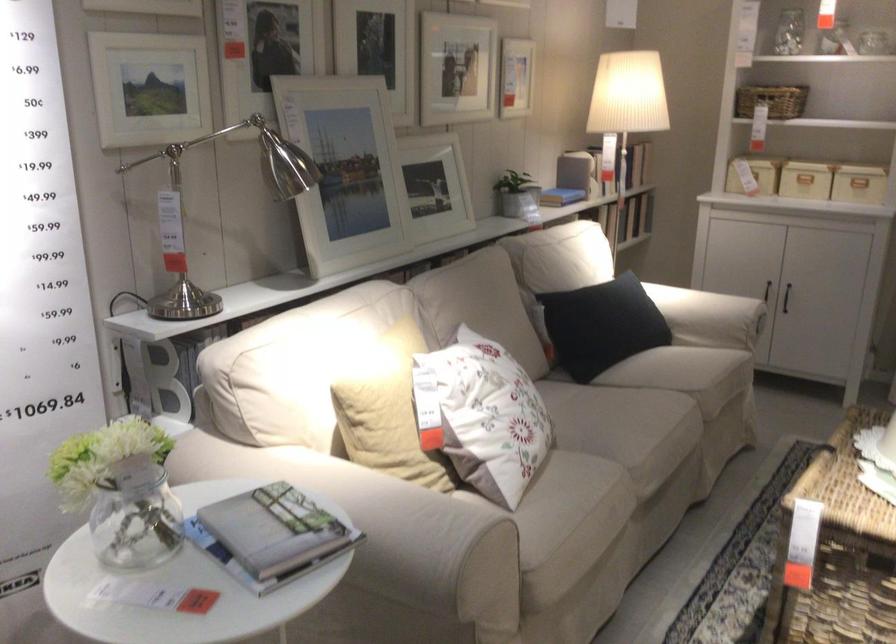
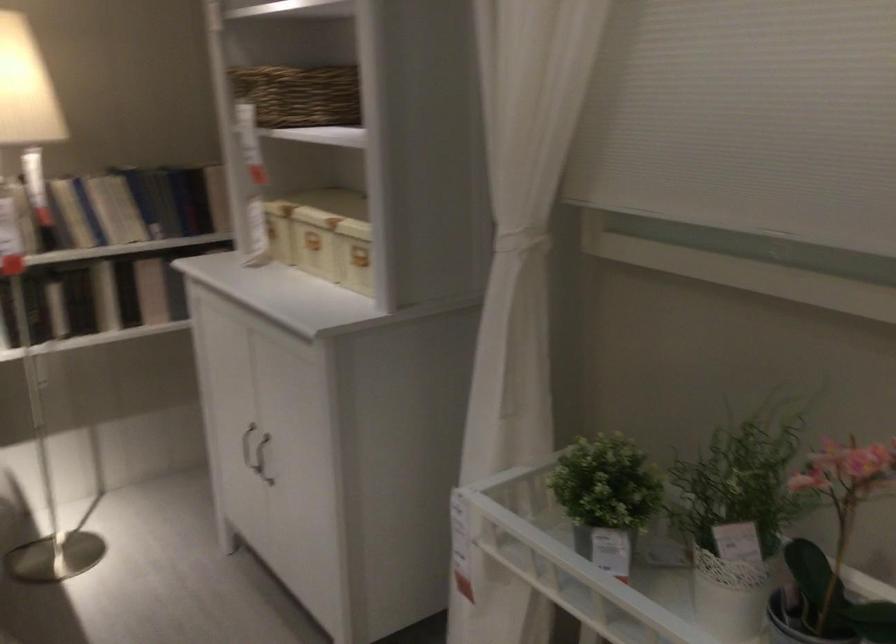
The point at (616, 211) is marked in the first image. Where is the corresponding point in the second image?

(105, 296)